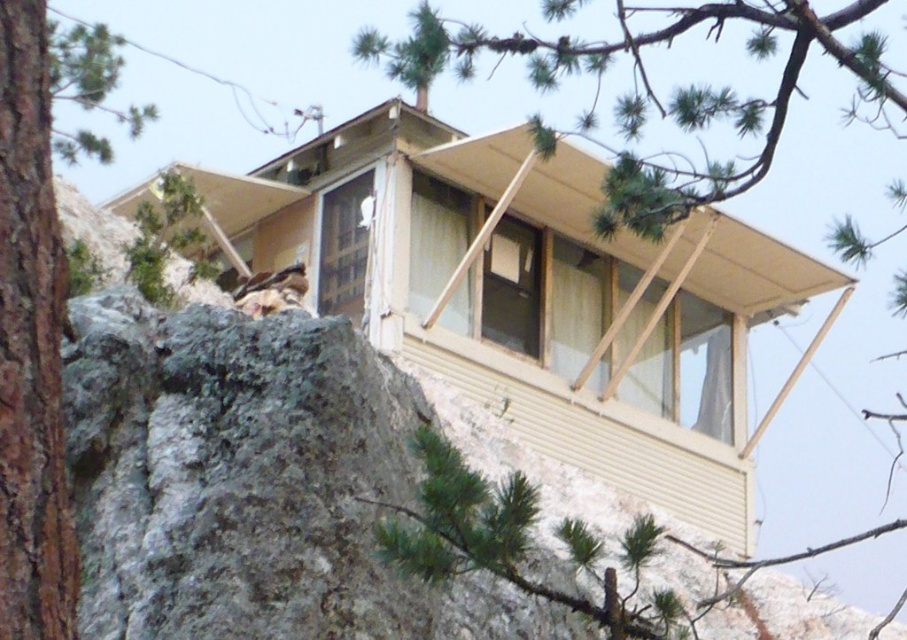
Question: In this image, where is green pine tree at upper center located relative to brown rough bark tree at left?

Choices:
 (A) right
 (B) left

Answer: (A)

Question: Does green pine tree at upper center appear over brown rough bark tree at left?

Choices:
 (A) yes
 (B) no

Answer: (A)

Question: Which object is farther from the camera taking this photo?

Choices:
 (A) green pine tree at upper center
 (B) brown rough bark tree at left

Answer: (A)

Question: Which point is closer to the camera?

Choices:
 (A) (25, 540)
 (B) (623, 115)

Answer: (A)

Question: Where is green pine tree at upper center located in relation to brown rough bark tree at left in the image?

Choices:
 (A) right
 (B) left

Answer: (A)